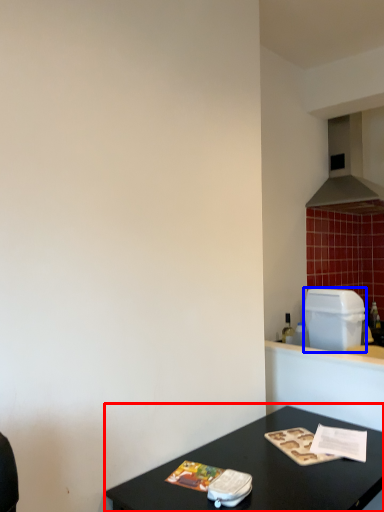
Question: Which object is closer to the camera taking this photo, table (highlighted by a red box) or appliance (highlighted by a blue box)?

Choices:
 (A) table
 (B) appliance

Answer: (A)